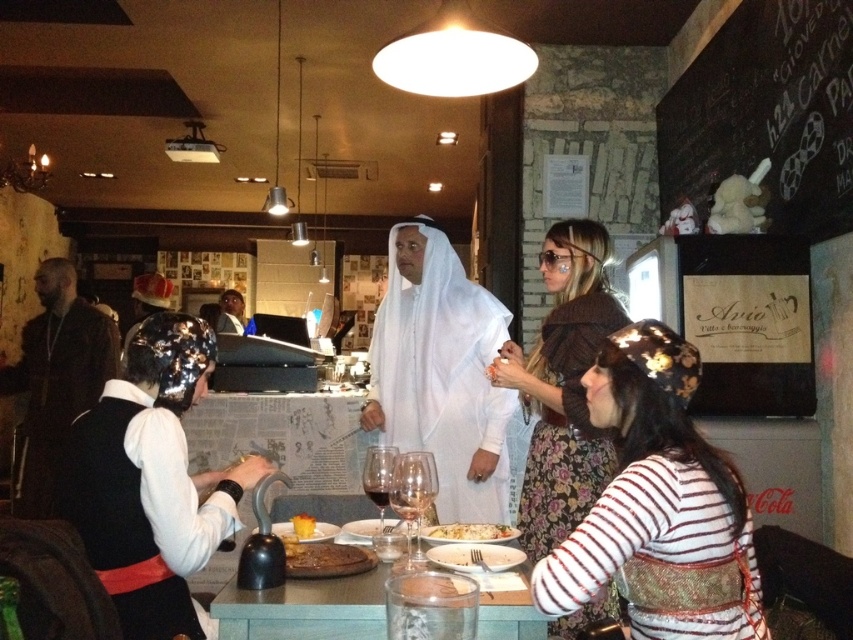
Which of these two, translucent glass water at lower center or translucent glass wine at table center, stands shorter?

translucent glass wine at table center is shorter.

You are a GUI agent. You are given a task and a screenshot of the screen. Output one action in this format:
    pyautogui.click(x=<x>, y=<y>)
    Task: Click on the translucent glass water at lower center
    Image resolution: width=853 pixels, height=640 pixels.
    Given the screenshot: What is the action you would take?
    pyautogui.click(x=305, y=609)

Identify the location of dark brown leather jacket at left. This screenshot has width=853, height=640. (56, 378).

Who is shorter, dark brown leather jacket at left or golden brown steak at center?

With less height is golden brown steak at center.

What do you see at coordinates (56, 378) in the screenshot? I see `dark brown leather jacket at left` at bounding box center [56, 378].

This screenshot has width=853, height=640. Identify the location of dark brown leather jacket at left. (56, 378).

What do you see at coordinates (767, 115) in the screenshot?
I see `chalkboard sign at upper right` at bounding box center [767, 115].

Which of these two, chalkboard sign at upper right or smooth white shirt at center, stands taller?

chalkboard sign at upper right

Measure the distance between chalkboard sign at upper right and camera.

chalkboard sign at upper right and camera are 2.32 meters apart.

Find the location of a particular element. chalkboard sign at upper right is located at coordinates pyautogui.click(x=767, y=115).